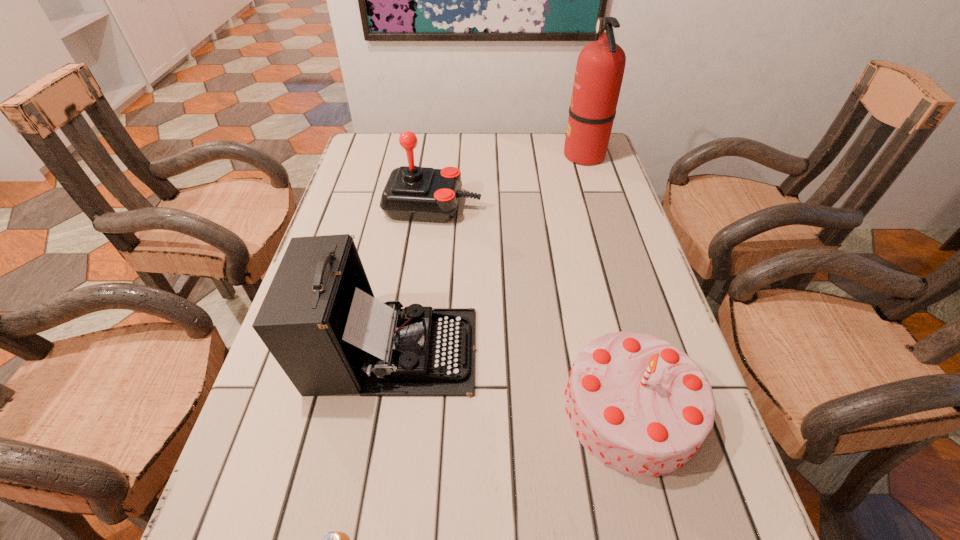
The image size is (960, 540). I want to click on free space located 0.370m on the left of the birthday cake, so click(361, 410).

Where is `object positioned at the far edge`? This screenshot has width=960, height=540. object positioned at the far edge is located at coordinates (600, 67).

You are a GUI agent. You are given a task and a screenshot of the screen. Output one action in this format:
    pyautogui.click(x=<x>, y=<y>)
    Task: Click on the typewriter at the left edge
    
    Given the screenshot: What is the action you would take?
    pyautogui.click(x=320, y=320)

Find the location of a particular element. This screenshot has height=540, width=960. joystick located at the left edge is located at coordinates (411, 193).

This screenshot has height=540, width=960. Identify the location of fire extinguisher present at the right edge. (600, 67).

Where is `birthday cake present at the right edge`? Image resolution: width=960 pixels, height=540 pixels. birthday cake present at the right edge is located at coordinates (640, 405).

Locate an element on the screen. object situated at the far right corner is located at coordinates (600, 67).

You are a GUI agent. You are given a task and a screenshot of the screen. Output one action in this format:
    pyautogui.click(x=<x>, y=<y>)
    Task: Click on the vacant region at the far edge
    This screenshot has height=540, width=960.
    Given the screenshot: What is the action you would take?
    pyautogui.click(x=444, y=144)

The height and width of the screenshot is (540, 960). What are the coordinates of `vacant region at the left edge of the desktop` in the screenshot? It's located at (280, 400).

Where is `free space at the right edge`? Image resolution: width=960 pixels, height=540 pixels. free space at the right edge is located at coordinates (705, 466).